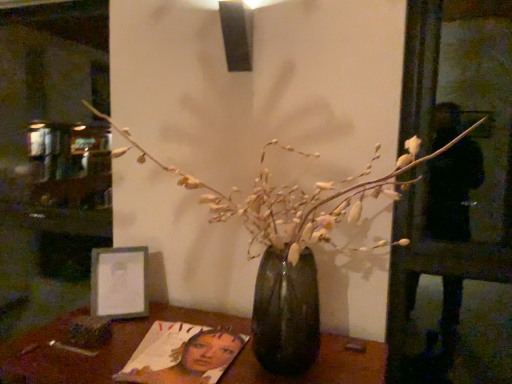
Question: From a real-world perspective, is metallic silver frame at lower left on top of translucent glass vase at center?

Choices:
 (A) yes
 (B) no

Answer: (B)

Question: Is metallic silver frame at lower left aimed at translucent glass vase at center?

Choices:
 (A) no
 (B) yes

Answer: (B)

Question: Is metallic silver frame at lower left to the left of translucent glass vase at center from the viewer's perspective?

Choices:
 (A) yes
 (B) no

Answer: (A)

Question: Is metallic silver frame at lower left to the right of translucent glass vase at center from the viewer's perspective?

Choices:
 (A) yes
 (B) no

Answer: (B)

Question: Considering the relative sizes of metallic silver frame at lower left and translucent glass vase at center in the image provided, is metallic silver frame at lower left smaller than translucent glass vase at center?

Choices:
 (A) no
 (B) yes

Answer: (B)

Question: Is point (160, 370) closer or farther from the camera than point (245, 360)?

Choices:
 (A) closer
 (B) farther

Answer: (A)

Question: From the image's perspective, is matte paper magazine at lower center located above or below wooden table at center?

Choices:
 (A) below
 (B) above

Answer: (B)

Question: From a real-world perspective, is matte paper magazine at lower center positioned above or below wooden table at center?

Choices:
 (A) below
 (B) above

Answer: (B)

Question: Relative to wooden table at center, is matte paper magazine at lower center in front or behind?

Choices:
 (A) front
 (B) behind

Answer: (B)

Question: Considering the positions of translucent glass vase at center and wooden table at center in the image, is translucent glass vase at center taller or shorter than wooden table at center?

Choices:
 (A) short
 (B) tall

Answer: (B)

Question: Relative to wooden table at center, is translucent glass vase at center in front or behind?

Choices:
 (A) front
 (B) behind

Answer: (A)

Question: Choose the correct answer: Is translucent glass vase at center inside wooden table at center or outside it?

Choices:
 (A) inside
 (B) outside

Answer: (B)

Question: In terms of size, does translucent glass vase at center appear bigger or smaller than wooden table at center?

Choices:
 (A) big
 (B) small

Answer: (A)

Question: In the image, is wooden table at center on the left side or the right side of metallic silver frame at lower left?

Choices:
 (A) right
 (B) left

Answer: (A)

Question: Considering the positions of point (76, 311) and point (132, 269), is point (76, 311) closer or farther from the camera than point (132, 269)?

Choices:
 (A) farther
 (B) closer

Answer: (A)